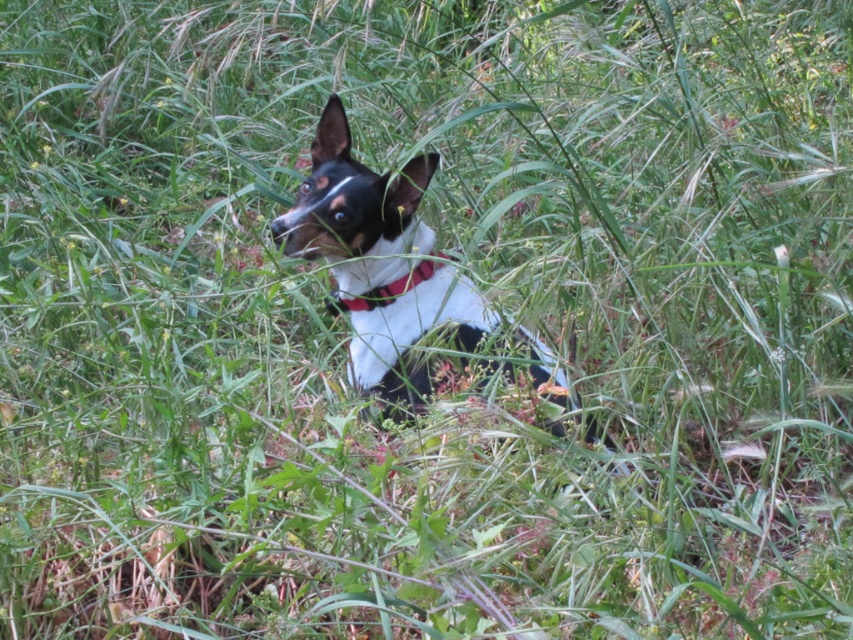
Does black and white fur at center appear over red fabric collar at center?

Actually, black and white fur at center is below red fabric collar at center.

Can you confirm if black and white fur at center is wider than red fabric collar at center?

Yes.

Between point (399, 273) and point (347, 298), which one is positioned in front?

Positioned in front is point (347, 298).

You are a GUI agent. You are given a task and a screenshot of the screen. Output one action in this format:
    pyautogui.click(x=<x>, y=<y>)
    Task: Click on the black and white fur at center
    This screenshot has height=640, width=853.
    Given the screenshot: What is the action you would take?
    pyautogui.click(x=379, y=260)